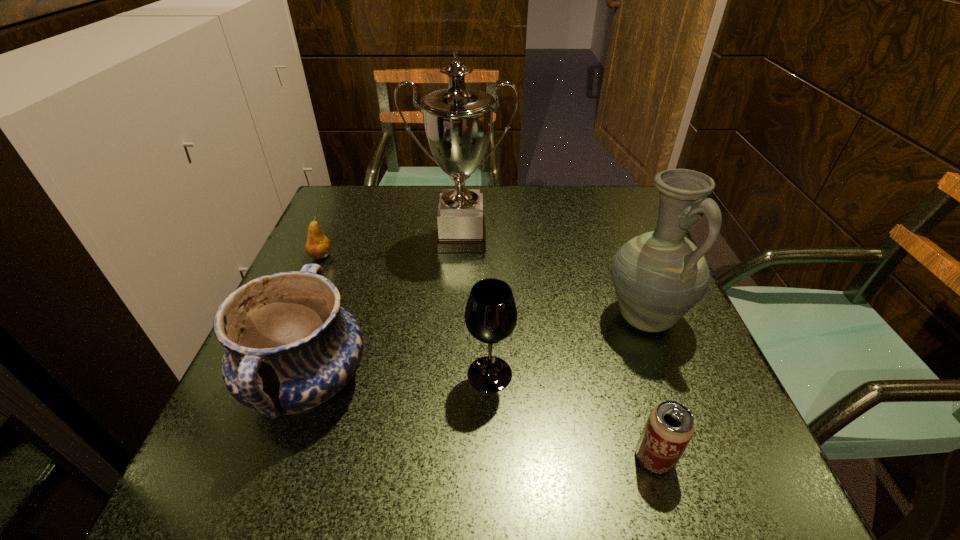
Find the location of a particular element. Image resolution: width=960 pixels, height=540 pixels. object situated at the near right corner is located at coordinates (670, 426).

Where is `free space at the far edge`? free space at the far edge is located at coordinates (413, 200).

You are a GUI agent. You are given a task and a screenshot of the screen. Output one action in this format:
    pyautogui.click(x=<x>, y=<y>)
    Task: Click on the free space at the near edge of the desktop
    This screenshot has height=540, width=960.
    Given the screenshot: What is the action you would take?
    pyautogui.click(x=598, y=472)

In the image, there is a desktop. Find the location of `vacant space at the left edge`. vacant space at the left edge is located at coordinates (312, 434).

Where is `free space at the right edge of the desktop`? This screenshot has height=540, width=960. free space at the right edge of the desktop is located at coordinates (x=679, y=347).

This screenshot has width=960, height=540. I want to click on vacant space at the far left corner of the desktop, so click(368, 213).

In the image, there is a desktop. What are the coordinates of `vacant space at the near left corner` in the screenshot? It's located at (302, 457).

You are a GUI agent. You are given a task and a screenshot of the screen. Output one action in this format:
    pyautogui.click(x=<x>, y=<y>)
    Task: Click on the empty space that is in between the pitcher and the trophy cup
    This screenshot has height=540, width=960.
    Given the screenshot: What is the action you would take?
    pyautogui.click(x=553, y=278)

Where is `empty space that is in between the beer can and the second tallest object`? empty space that is in between the beer can and the second tallest object is located at coordinates (649, 387).

At what (x,y) coordinates should I click in order to perform the action: click on blank region between the trophy cup and the pottery. Please return your answer as a coordinate pair (x, y). This screenshot has width=960, height=540. Looking at the image, I should click on (384, 310).